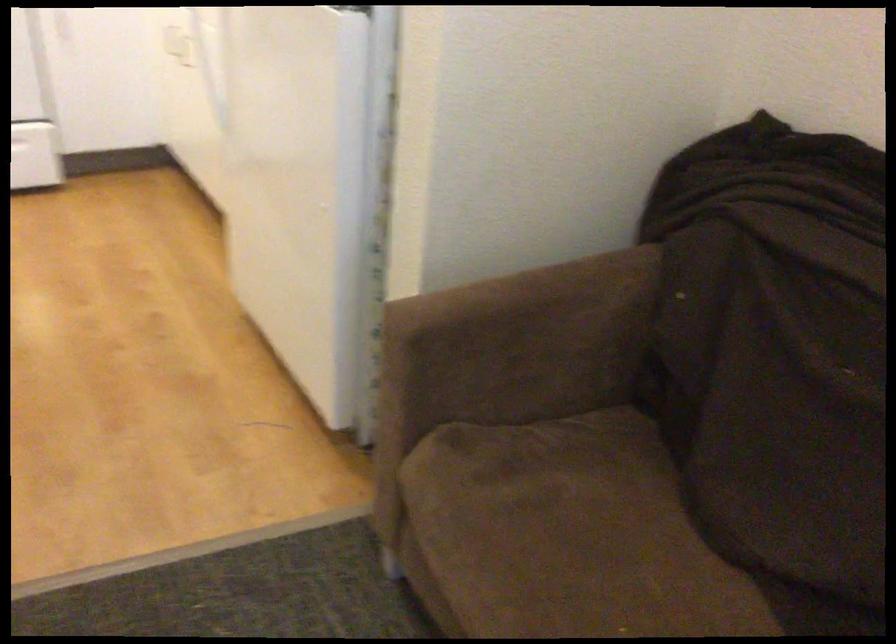
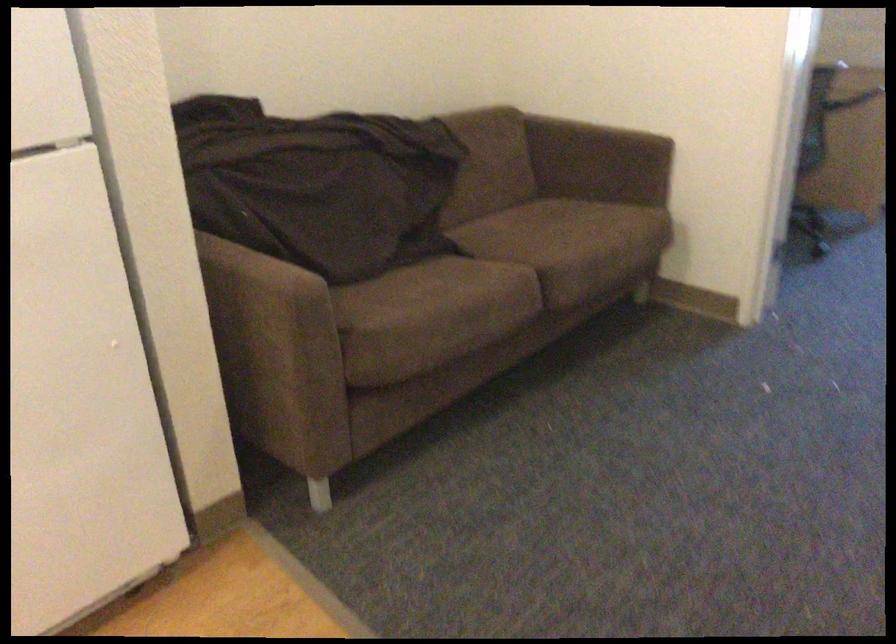
Locate, in the second image, the point that corresponds to pixel 435 371 in the first image.

(271, 342)